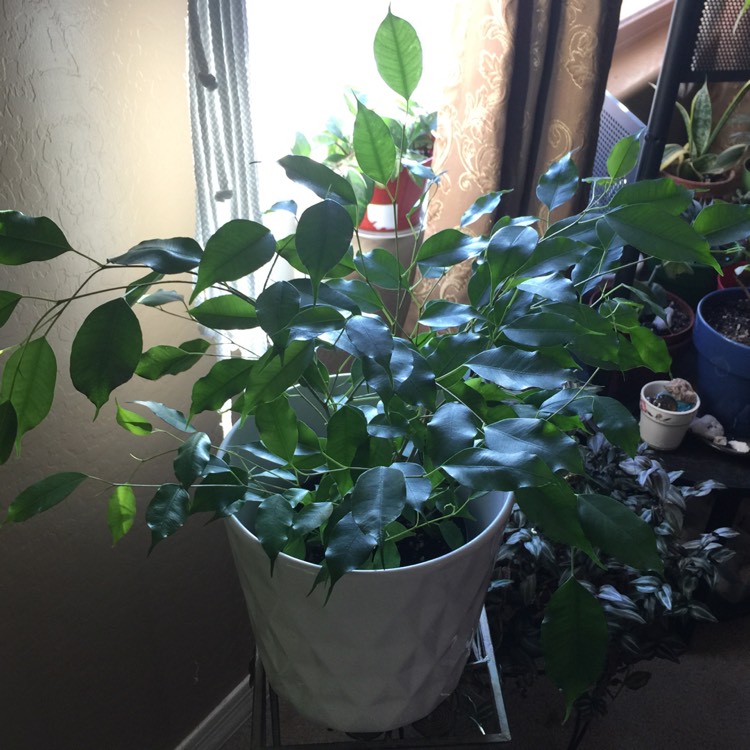
Find the location of a particular element. The image size is (750, 750). plant in center of image is located at coordinates point(376,465).